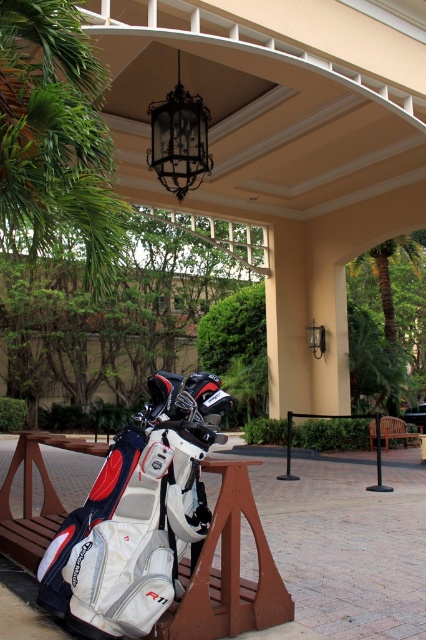
You are planning to take a photo of the green leafy palm tree at upper left and the brown wooden park bench at lower right. Which object appears smaller in the photo?

The green leafy palm tree at upper left appears smaller than the brown wooden park bench at lower right in the photo.